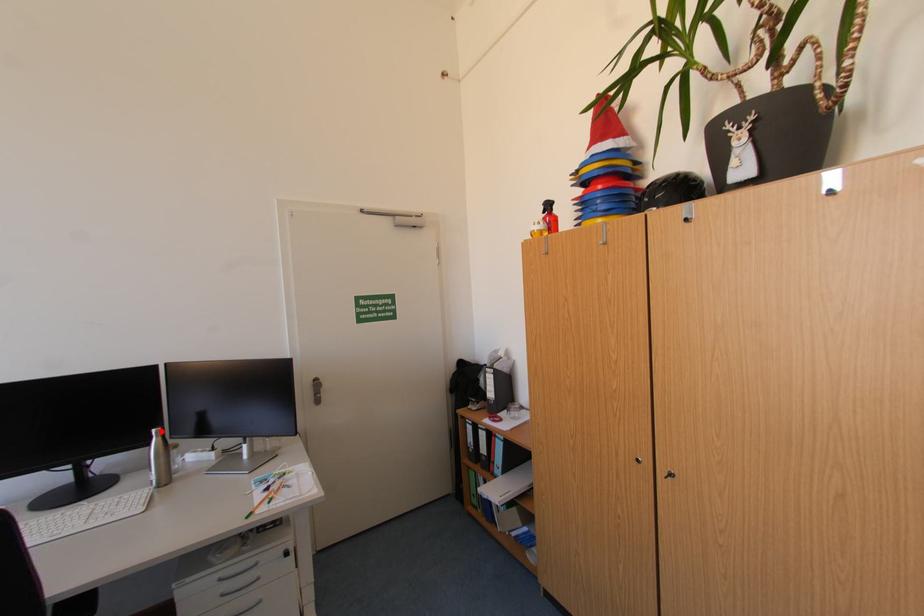
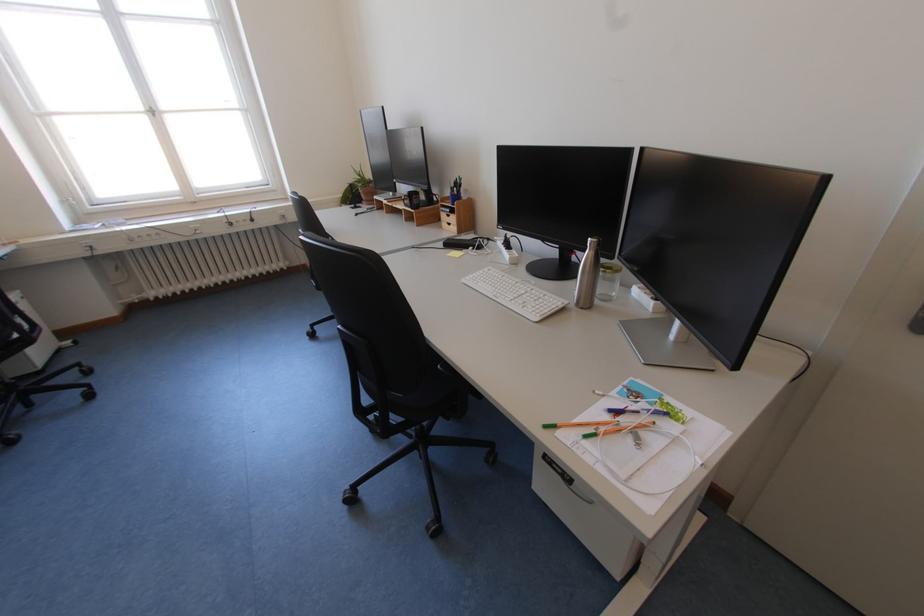
Question: I am providing you with two images of the same scene from different viewpoints. A red point is shown in image1. For the corresponding object point in image2, is it positioned nearer or farther from the camera?

Choices:
 (A) Nearer
 (B) Farther

Answer: (A)